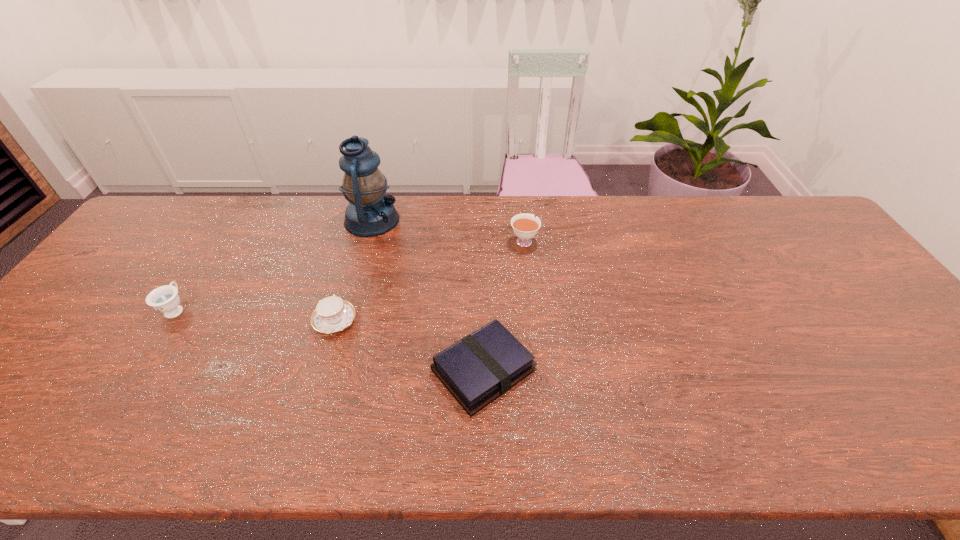
Find the location of a particular element. The height and width of the screenshot is (540, 960). vacant space located 0.100m on the side of the leftmost object with the handle is located at coordinates (201, 270).

Image resolution: width=960 pixels, height=540 pixels. I want to click on free space located on the side of the leftmost object with the handle, so click(x=239, y=210).

This screenshot has width=960, height=540. What are the coordinates of `vacant space situated 0.240m on the side with the handle of the second teacup from right to left` in the screenshot? It's located at (357, 246).

The height and width of the screenshot is (540, 960). What are the coordinates of `vacant space located on the side with the handle of the second teacup from right to left` in the screenshot? It's located at (351, 266).

Find the location of a particular element. blank space located 0.380m on the side with the handle of the second teacup from right to left is located at coordinates (366, 218).

Locate an element on the screen. free space located 0.180m on the back of the book is located at coordinates (483, 279).

The width and height of the screenshot is (960, 540). What are the coordinates of `lantern located at the far edge` in the screenshot? It's located at (370, 212).

The image size is (960, 540). In order to click on teacup that is at the far edge in this screenshot , I will do `click(525, 226)`.

Find the location of `object that is at the near edge`. object that is at the near edge is located at coordinates (484, 365).

In the image, there is a desktop. Identify the location of vacant space at the far edge. (305, 217).